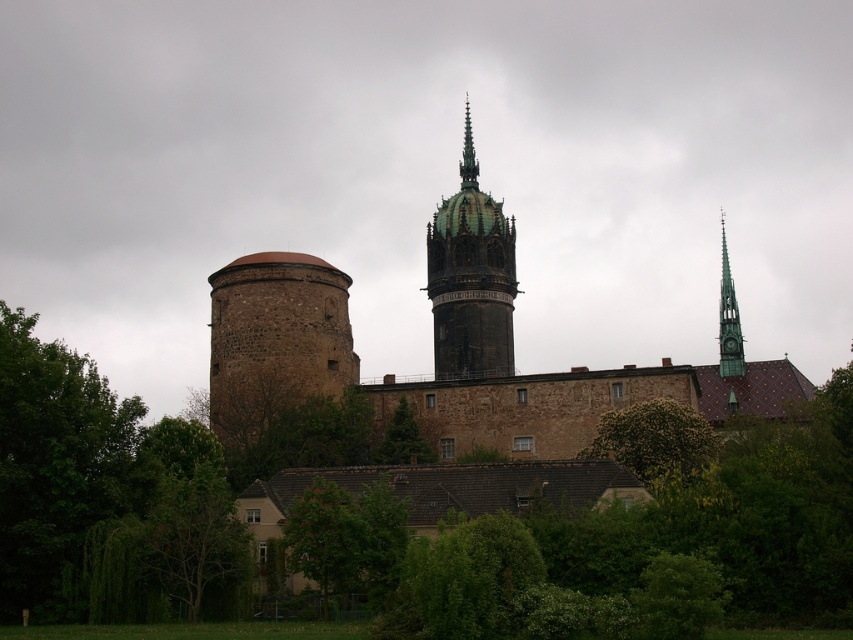
You are standing in the historic stone structure and looking out through a window. You notice the green glass spire at right and the green leafy tree at center in the distance. Which object appears taller from your vantage point?

The green glass spire at right appears taller than the green leafy tree at center because it has a greater height compared to the green leafy tree at center.

You are a tourist standing in front of the historic stone structure. You notice the green leafy tree at center and the green glass spire at right. Which object is closer to you, the tourist?

The green glass spire at right is closer to you because the green leafy tree at center is behind it.